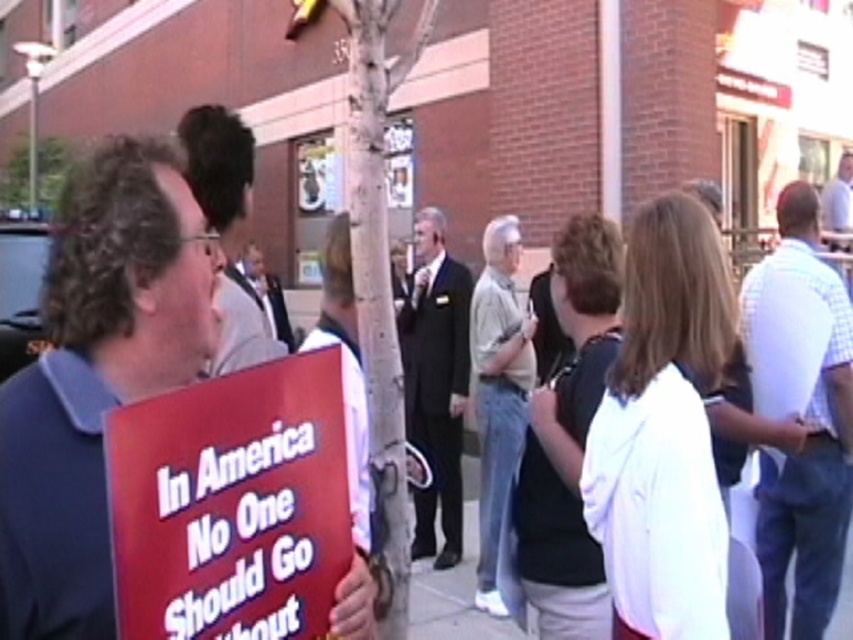
You are standing at the center of the image and want to locate the white checkered shirt at right. Which direction should you look to find it?

You should look to the right to find the white checkered shirt at right since it is located at point 0.650 on the x axis, which is to the right side of the image.

Based on the scene description, which object is larger in size between the white checkered shirt at right and the gray concrete pavement at lower center?

The white checkered shirt at right is bigger than the gray concrete pavement at lower center according to the description.